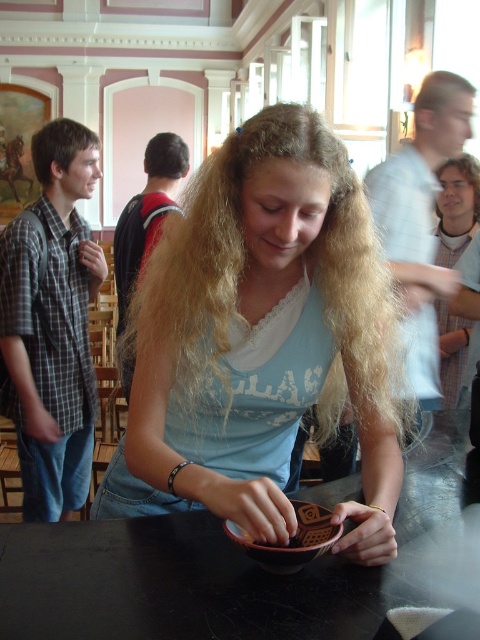
You are a photographer trying to capture a clear shot of the plaid shirt at left and the blonde hair at upper center. Since you want both subjects to appear equally prominent in the photo, which one should you zoom in on more?

The plaid shirt at left is bigger than the blonde hair at upper center, so you should zoom in more on the blonde hair at upper center to make them appear equally prominent.